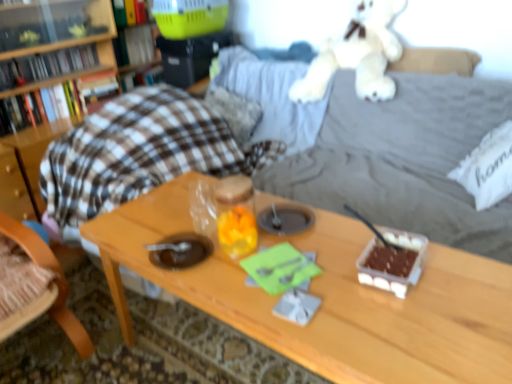
You are a GUI agent. You are given a task and a screenshot of the screen. Output one action in this format:
    pyautogui.click(x=<x>, y=<y>)
    Task: Click on the free location above wooden table at center (from a real-world perspective)
    This screenshot has width=512, height=384.
    Given the screenshot: What is the action you would take?
    pyautogui.click(x=329, y=273)